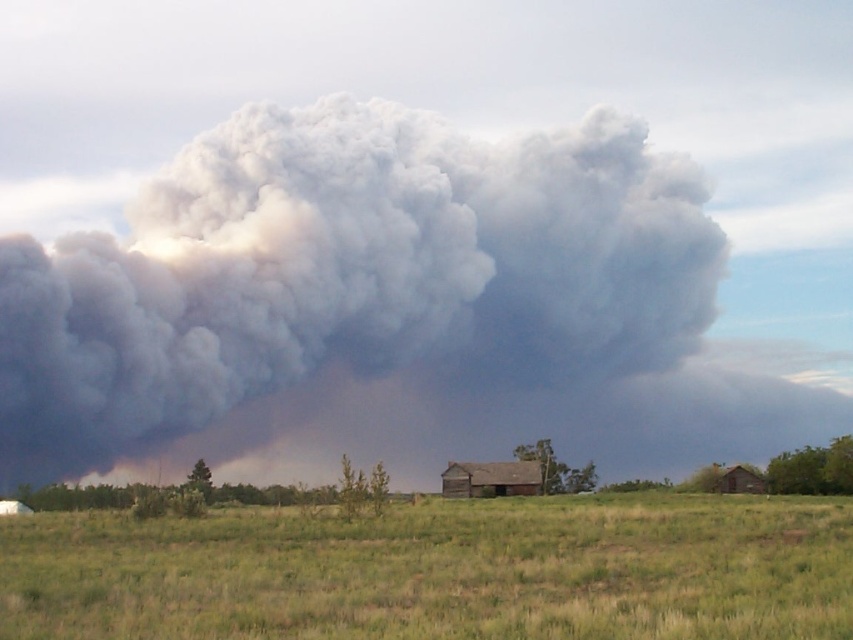
Question: Which point is closer to the camera?

Choices:
 (A) gray/dense smoke at center
 (B) green grass at center

Answer: (B)

Question: In this image, where is gray/dense smoke at center located relative to green grass at center?

Choices:
 (A) below
 (B) above

Answer: (B)

Question: Which point is farther to the camera?

Choices:
 (A) (1, 554)
 (B) (397, 266)

Answer: (B)

Question: Does gray/dense smoke at center appear under green grass at center?

Choices:
 (A) yes
 (B) no

Answer: (B)

Question: Is gray/dense smoke at center to the left of green grass at center from the viewer's perspective?

Choices:
 (A) yes
 (B) no

Answer: (A)